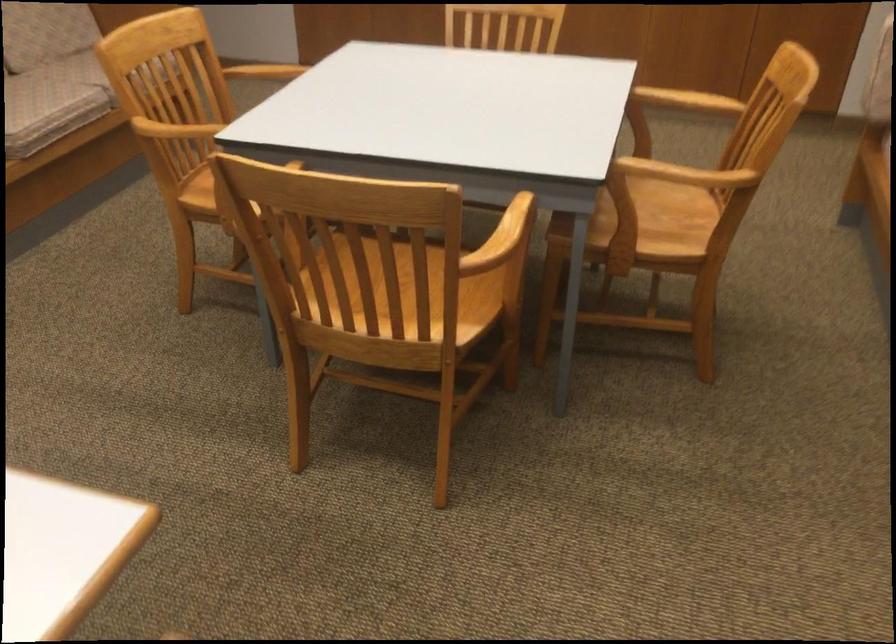
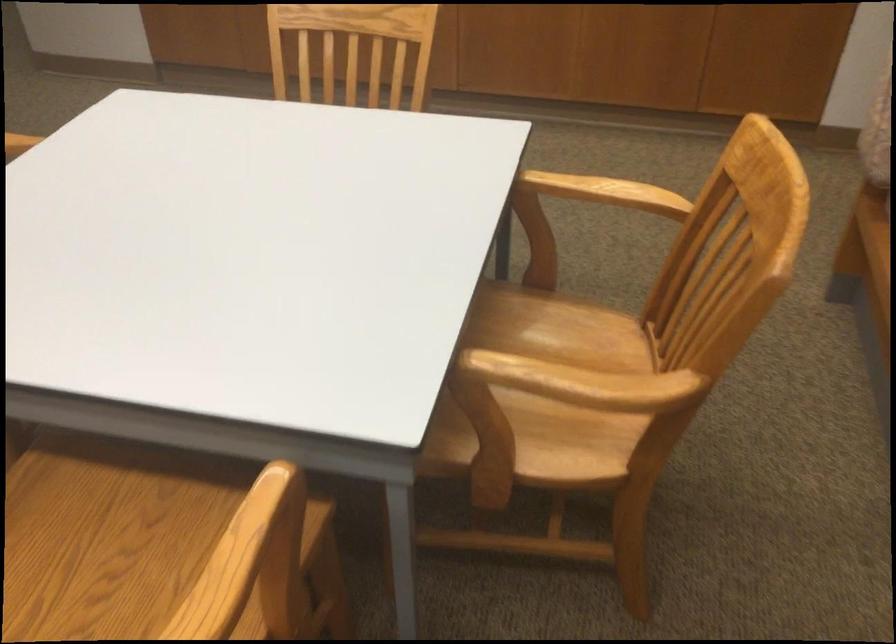
Where in the second image is the point corresponding to point 688,93 from the first image?

(605, 192)